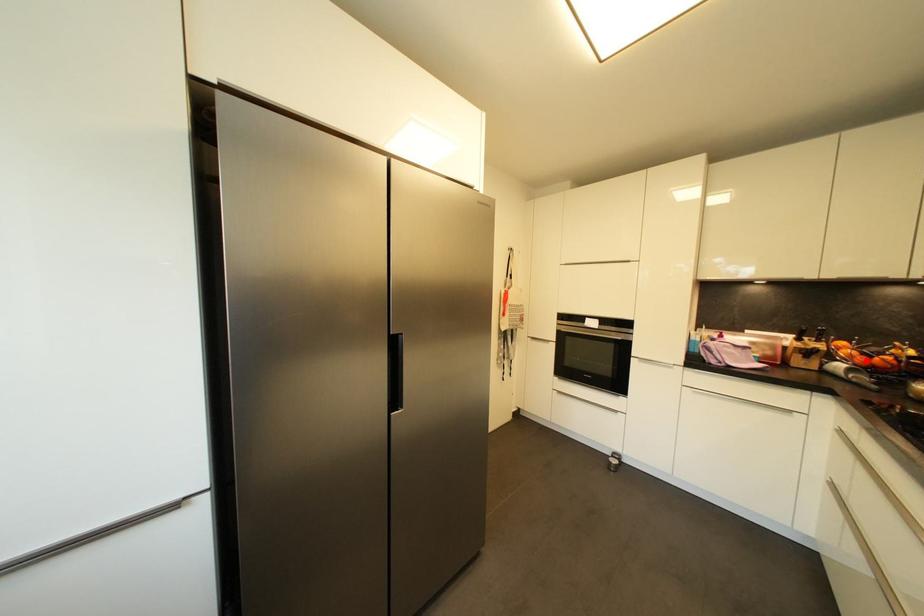
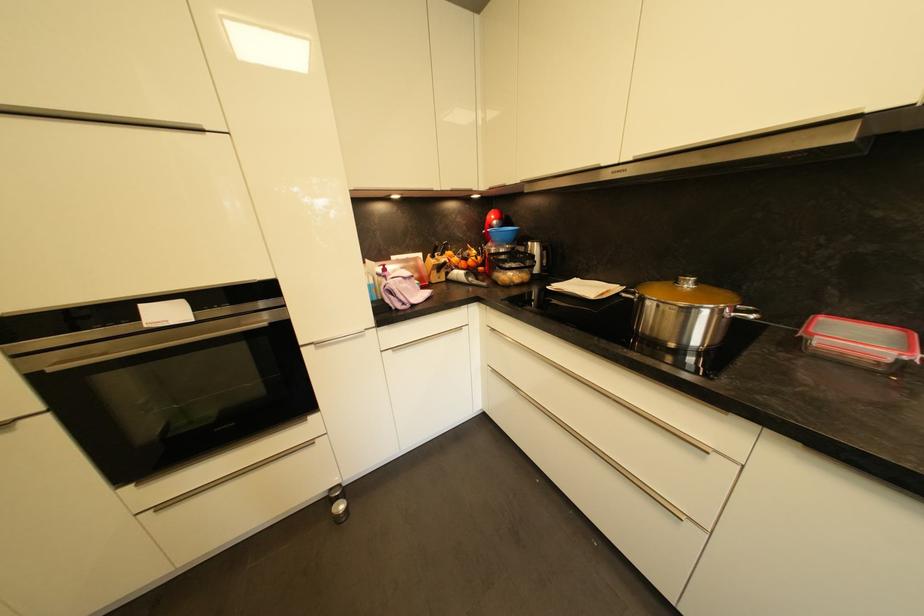
The point at the highlighted location is marked in the first image. Where is the corresponding point in the second image?

(468, 265)